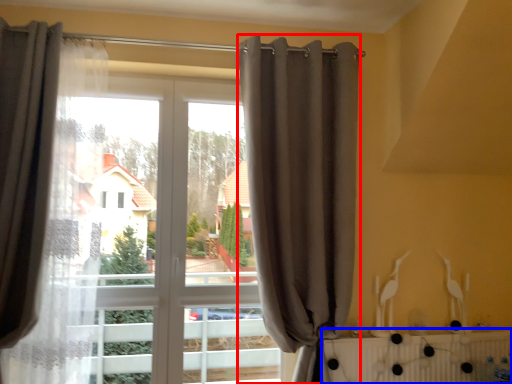
Question: Which object appears farthest to the camera in this image, curtain (highlighted by a red box) or radiator (highlighted by a blue box)?

Choices:
 (A) curtain
 (B) radiator

Answer: (B)